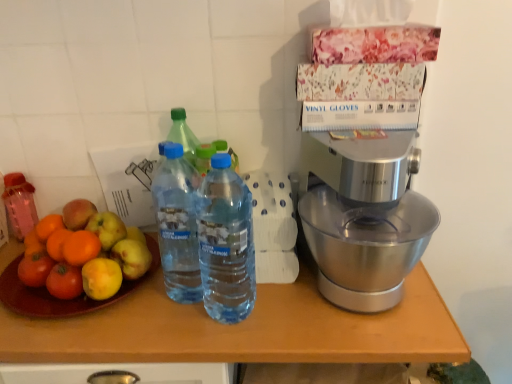
Locate an element on the screen. The height and width of the screenshot is (384, 512). free space to the right of transparent plastic bottle at center, which is counted as the 3th bottle, starting from the left is located at coordinates (311, 317).